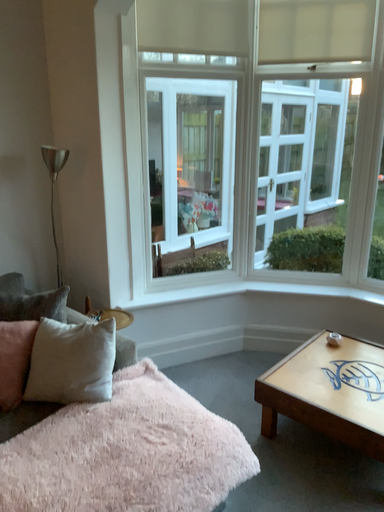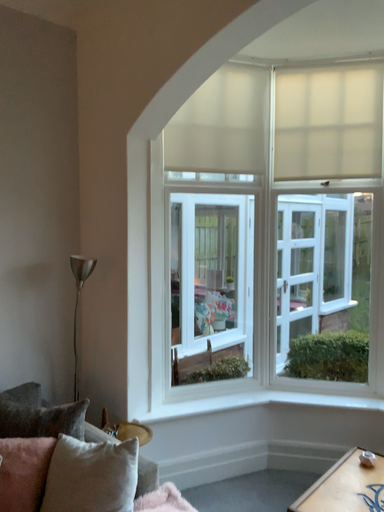
Question: Which way did the camera rotate in the video?

Choices:
 (A) rotated upward
 (B) rotated downward

Answer: (A)